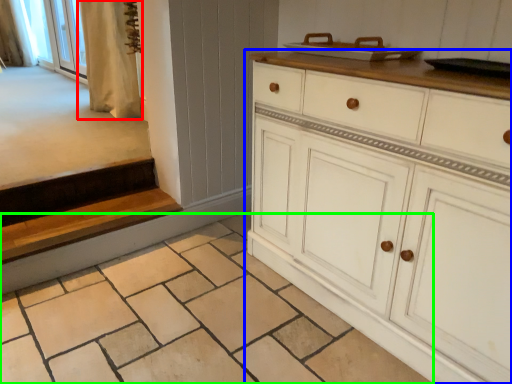
Question: Based on their relative distances, which object is nearer to curtain (highlighted by a red box)? Choose from chest of drawers (highlighted by a blue box) and tile (highlighted by a green box).

Choices:
 (A) chest of drawers
 (B) tile

Answer: (B)